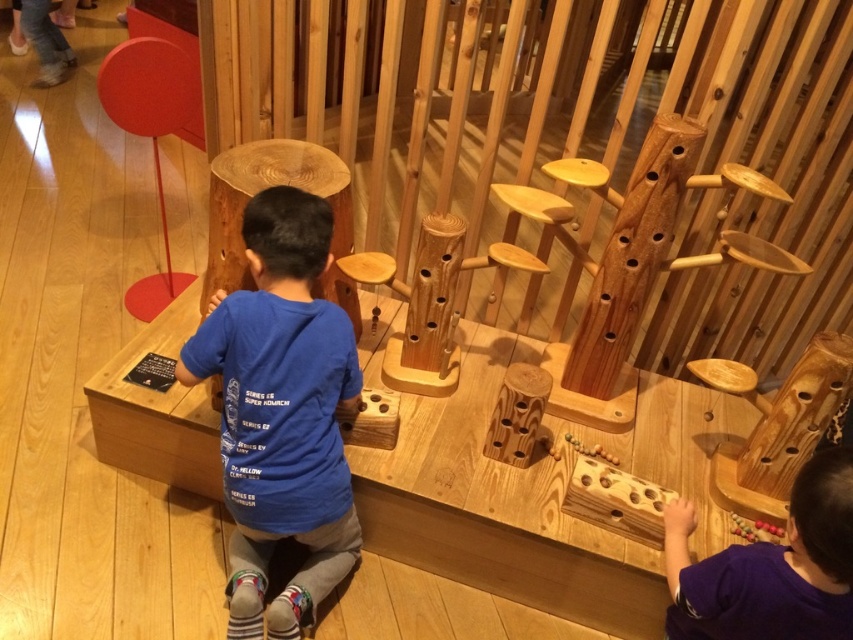
Who is lower down, blue cotton shirt at center or purple matte shirt at lower right?

purple matte shirt at lower right is lower down.

Can you confirm if blue cotton shirt at center is wider than purple matte shirt at lower right?

Yes, blue cotton shirt at center is wider than purple matte shirt at lower right.

Who is more distant from viewer, (268, 504) or (840, 630)?

The point (268, 504) is behind.

Where is `blue cotton shirt at center`? The height and width of the screenshot is (640, 853). blue cotton shirt at center is located at coordinates (281, 412).